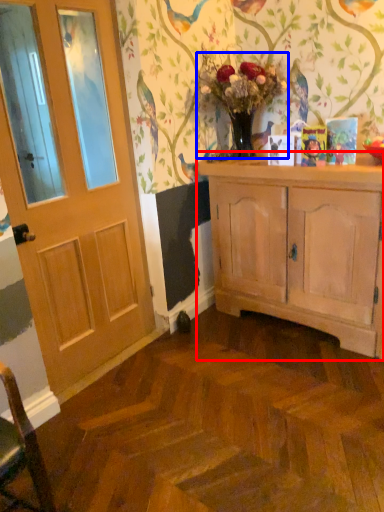
Question: Which object appears farthest to the camera in this image, cabinetry (highlighted by a red box) or floral arrangement (highlighted by a blue box)?

Choices:
 (A) cabinetry
 (B) floral arrangement

Answer: (B)